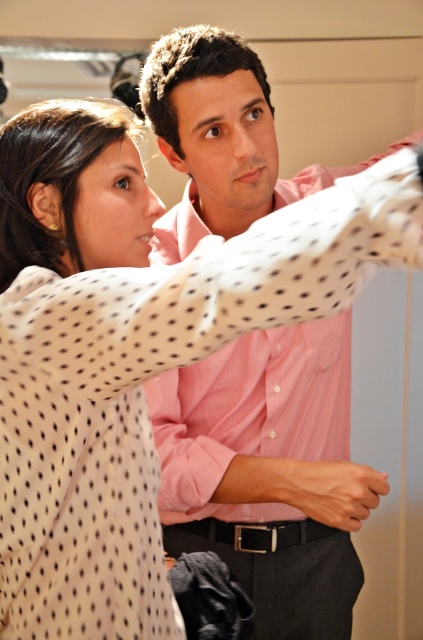
Is polka dot blouse at upper left bigger than pink cotton shirt at center?

Indeed, polka dot blouse at upper left has a larger size compared to pink cotton shirt at center.

Which is more to the left, polka dot blouse at upper left or pink cotton shirt at center?

From the viewer's perspective, polka dot blouse at upper left appears more on the left side.

Which is in front, point (114, 490) or point (170, 241)?

Point (114, 490)

Where is `polka dot blouse at upper left`? This screenshot has height=640, width=423. polka dot blouse at upper left is located at coordinates (99, 365).